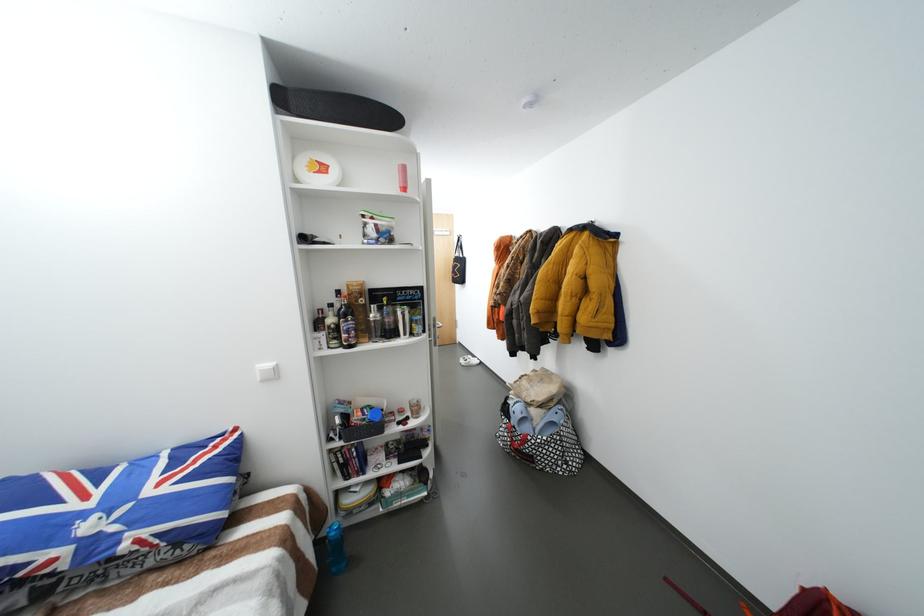
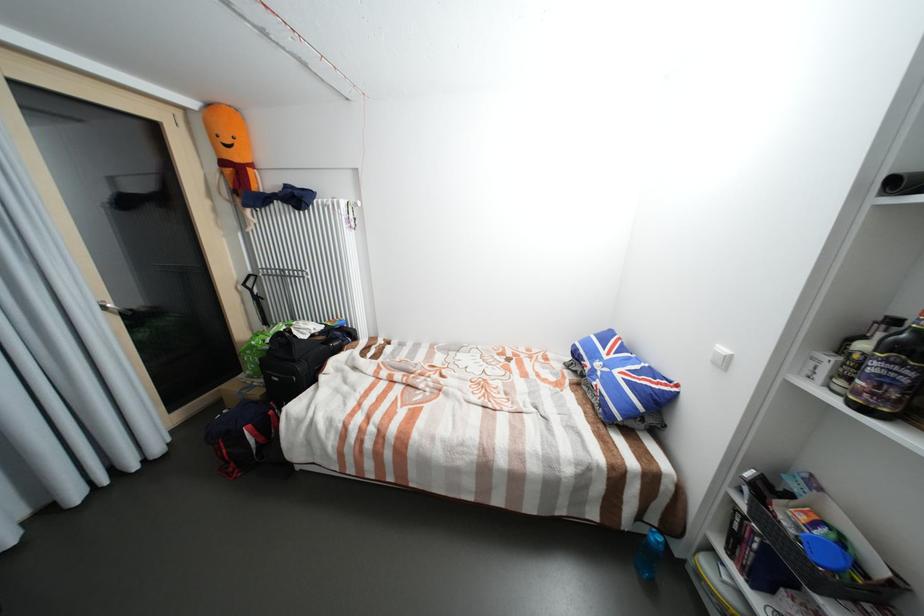
Where in the second image is the point corresponding to (358,347) from the first image?

(870, 410)